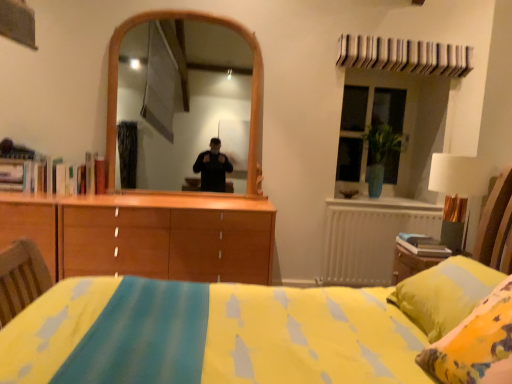
Question: Does green glass vase at upper right lie behind white fabric lampshade at right?

Choices:
 (A) yes
 (B) no

Answer: (A)

Question: Considering the relative sizes of green glass vase at upper right and white fabric lampshade at right in the image provided, is green glass vase at upper right smaller than white fabric lampshade at right?

Choices:
 (A) yes
 (B) no

Answer: (B)

Question: Are green glass vase at upper right and white fabric lampshade at right located far from each other?

Choices:
 (A) no
 (B) yes

Answer: (B)

Question: Is green glass vase at upper right touching white fabric lampshade at right?

Choices:
 (A) yes
 (B) no

Answer: (B)

Question: Is green glass vase at upper right bigger than white fabric lampshade at right?

Choices:
 (A) no
 (B) yes

Answer: (B)

Question: Considering the relative sizes of green glass vase at upper right and white fabric lampshade at right in the image provided, is green glass vase at upper right taller than white fabric lampshade at right?

Choices:
 (A) no
 (B) yes

Answer: (B)

Question: Could you tell me if white metallic radiator at right is facing green glass vase at upper right?

Choices:
 (A) no
 (B) yes

Answer: (A)

Question: From a real-world perspective, is white metallic radiator at right under green glass vase at upper right?

Choices:
 (A) no
 (B) yes

Answer: (B)

Question: Is white metallic radiator at right oriented away from green glass vase at upper right?

Choices:
 (A) yes
 (B) no

Answer: (B)

Question: Is white metallic radiator at right at the left side of green glass vase at upper right?

Choices:
 (A) yes
 (B) no

Answer: (A)

Question: Does white metallic radiator at right come behind green glass vase at upper right?

Choices:
 (A) yes
 (B) no

Answer: (B)

Question: Considering the relative positions of white metallic radiator at right and green glass vase at upper right in the image provided, is white metallic radiator at right in front of green glass vase at upper right?

Choices:
 (A) yes
 (B) no

Answer: (A)

Question: Is white metallic radiator at right not inside white fabric lampshade at right?

Choices:
 (A) no
 (B) yes

Answer: (B)